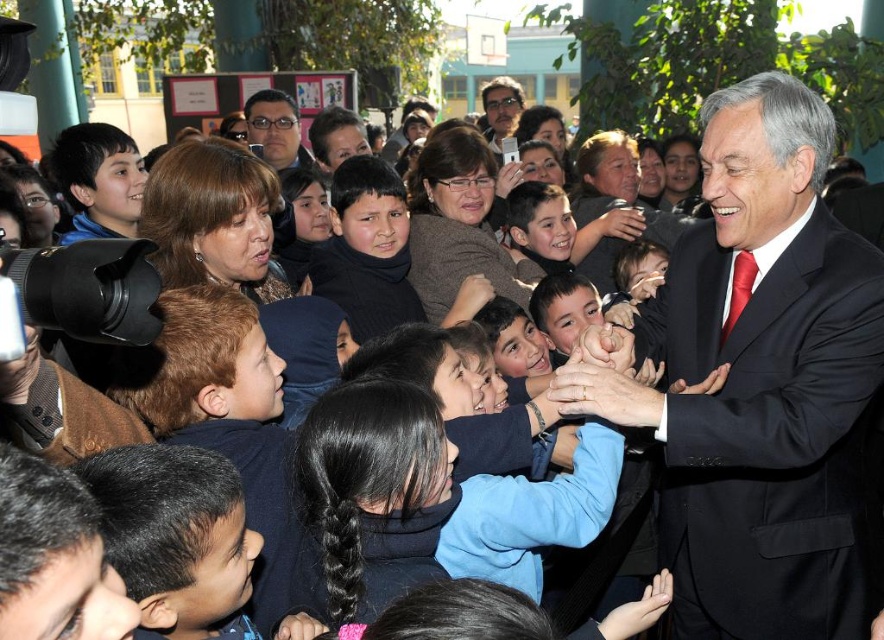
Who is higher up, blue fleece jacket at center or matte black glasses at center?

matte black glasses at center

From the picture: Can you confirm if blue fleece jacket at center is positioned below matte black glasses at center?

Indeed, blue fleece jacket at center is positioned under matte black glasses at center.

What do you see at coordinates (370, 497) in the screenshot? I see `blue fleece jacket at center` at bounding box center [370, 497].

Find the location of `blue fleece jacket at center`. blue fleece jacket at center is located at coordinates (370, 497).

Between point (679, 426) and point (339, 125), which one is positioned in front?

Point (679, 426) is more forward.

In the scene shown: Does black suit at center have a lesser height compared to matte black jacket at center?

Yes, black suit at center is shorter than matte black jacket at center.

Who is more forward, (819, 140) or (336, 115)?

Point (819, 140) is more forward.

I want to click on black suit at center, so click(759, 380).

Between dark brown sweater at center and matte black jacket at center, which one has less height?

Standing shorter between the two is matte black jacket at center.

Between point (333, 177) and point (340, 161), which one is positioned in front?

Point (333, 177)

The width and height of the screenshot is (884, 640). I want to click on dark brown sweater at center, so click(367, 250).